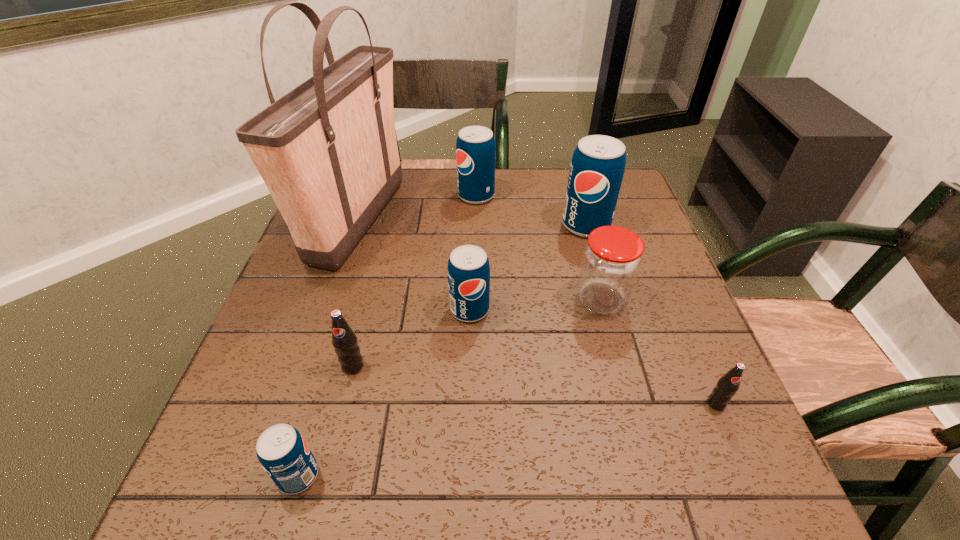
At what (x,y) coordinates should I click in order to perform the action: click on free space at the far edge of the desktop. Please return your answer as a coordinate pair (x, y). The width and height of the screenshot is (960, 540). Looking at the image, I should click on (429, 200).

Identify the location of vacant space at the near edge of the desktop. (419, 469).

Find the location of a particular element. free location at the right edge is located at coordinates (673, 274).

Where is `free space at the far right corner of the desktop`? This screenshot has width=960, height=540. free space at the far right corner of the desktop is located at coordinates (640, 211).

Find the location of a particular element. The image size is (960, 540). vacant region between the leftmost blue pop and the third nearest object is located at coordinates (325, 421).

The image size is (960, 540). Find the location of `empty space that is in between the second biggest blue pop and the jar`. empty space that is in between the second biggest blue pop and the jar is located at coordinates (539, 248).

This screenshot has height=540, width=960. Find the location of `free area in between the farthest blue pop and the nearest object`. free area in between the farthest blue pop and the nearest object is located at coordinates (387, 335).

This screenshot has height=540, width=960. I want to click on free space between the farthest pop and the farther black pop, so click(415, 281).

Find the location of a particular element. vacant area between the second farthest pop and the right black pop is located at coordinates (651, 314).

Where is `free space between the nearer black pop and the seventh shortest object`? free space between the nearer black pop and the seventh shortest object is located at coordinates (651, 314).